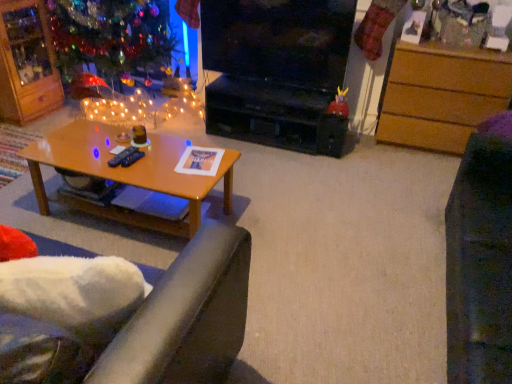
Image resolution: width=512 pixels, height=384 pixels. I want to click on empty space that is ontop of wooden coffee table at center (from a real-world perspective), so click(x=135, y=154).